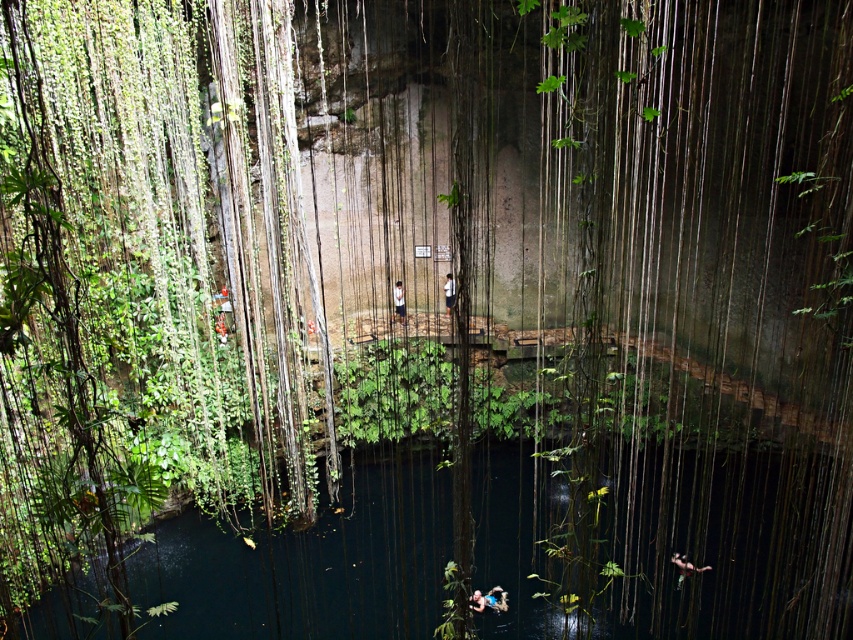
Question: Which point is farther to the camera?

Choices:
 (A) light blue shirt at center
 (B) dark blue water at center
 (C) white fabric shirt at center

Answer: (A)

Question: Which of the following is the closest to the observer?

Choices:
 (A) white fabric shirt at center
 (B) dark blue water at center

Answer: (B)

Question: Is dark blue water at center to the left of light blue shirt at center from the viewer's perspective?

Choices:
 (A) no
 (B) yes

Answer: (A)

Question: From the image, what is the correct spatial relationship of dark blue water at center in relation to light blue shirt at center?

Choices:
 (A) left
 (B) right

Answer: (B)

Question: Can you confirm if dark blue water at center is wider than white fabric shirt at center?

Choices:
 (A) yes
 (B) no

Answer: (A)

Question: Estimate the real-world distances between objects in this image. Which object is closer to the light blue shirt at center?

Choices:
 (A) white fabric shirt at center
 (B) dark blue water at center

Answer: (A)